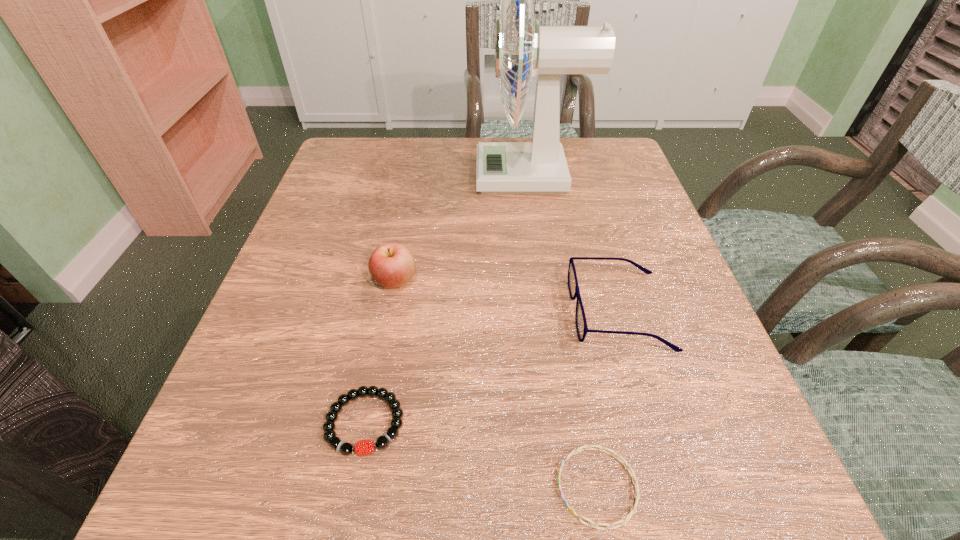
Locate an element on the screen. The width and height of the screenshot is (960, 540). object at the near edge is located at coordinates (587, 447).

You are a GUI agent. You are given a task and a screenshot of the screen. Output one action in this format:
    pyautogui.click(x=<x>, y=<y>)
    Task: Click on the object that is at the left edge
    
    Given the screenshot: What is the action you would take?
    pyautogui.click(x=364, y=447)

This screenshot has width=960, height=540. I want to click on fan located in the right edge section of the desktop, so click(538, 167).

Locate an element on the screen. This screenshot has height=540, width=960. spectacles located in the right edge section of the desktop is located at coordinates (581, 324).

Locate an element on the screen. object that is at the far right corner is located at coordinates (538, 167).

This screenshot has height=540, width=960. Find the location of `blank space at the far edge of the desktop`. blank space at the far edge of the desktop is located at coordinates (448, 170).

This screenshot has height=540, width=960. Identify the location of free space at the near edge. (327, 524).

Locate an element on the screen. The image size is (960, 540). free space at the left edge of the desktop is located at coordinates (314, 330).

In the image, there is a desktop. At what (x,y) coordinates should I click in order to perform the action: click on vacant space at the right edge. Please return your answer as a coordinate pair (x, y). This screenshot has height=540, width=960. Looking at the image, I should click on (701, 402).

The width and height of the screenshot is (960, 540). I want to click on vacant space at the far left corner of the desktop, so click(x=390, y=140).